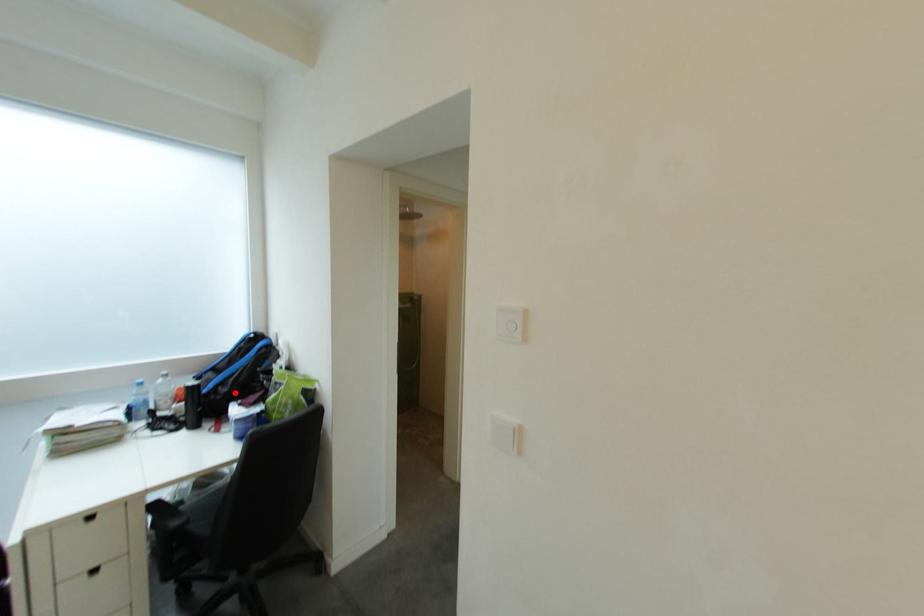
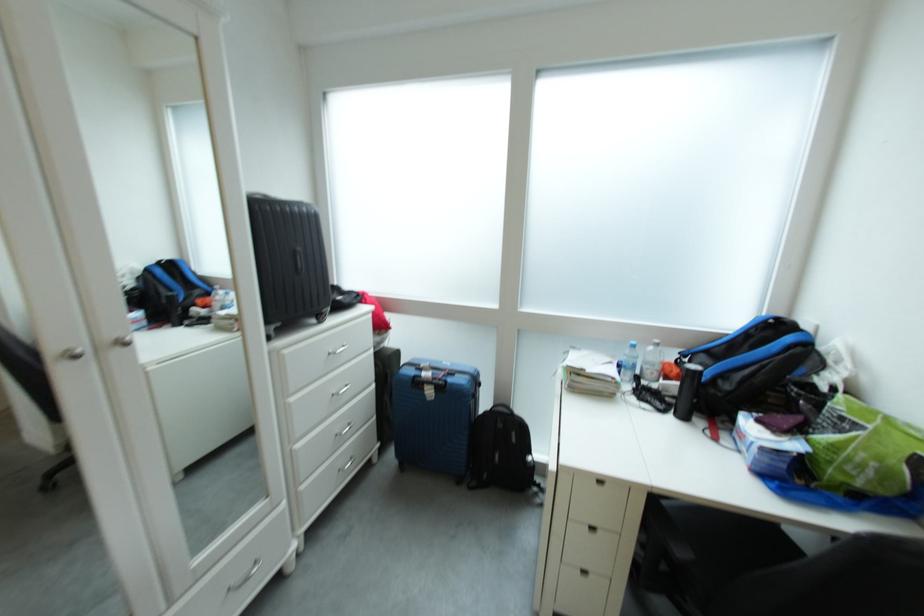
Find the pixel in the second image that matches the highlighted location in the first image.

(737, 390)